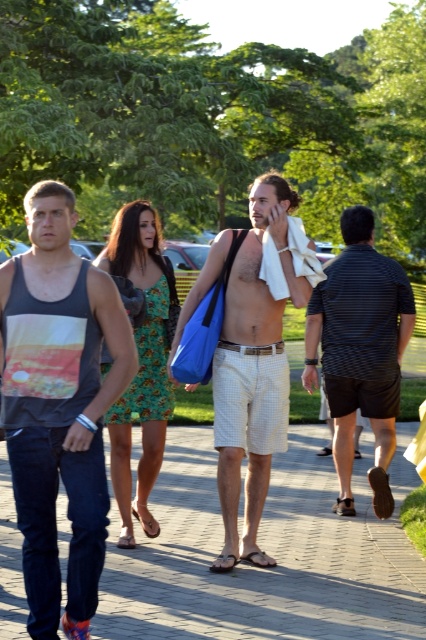
You are standing in the park and see two points marked in the image. Which point is closer to you, point (207, 483) or point (121, 268)?

Point (121, 268) is closer to you because it is less further to the camera than point (207, 483).

You are a photographer trying to capture a photo of the dark gray tank top at left and the striped cotton shirt at right. Since the sunlight is casting shadows, which object might be in shadow and harder to photograph clearly?

The dark gray tank top at left is located below the striped cotton shirt at right, so it might be in shadow and harder to photograph clearly.

You are a photographer trying to capture a photo of the beige checkered shorts at center and the striped cotton shirt at right. Based on their heights, which one should you focus on first to ensure both are in frame?

The beige checkered shorts at center is much taller than the striped cotton shirt at right, so you should focus on the beige checkered shorts at center first to ensure both are in frame.